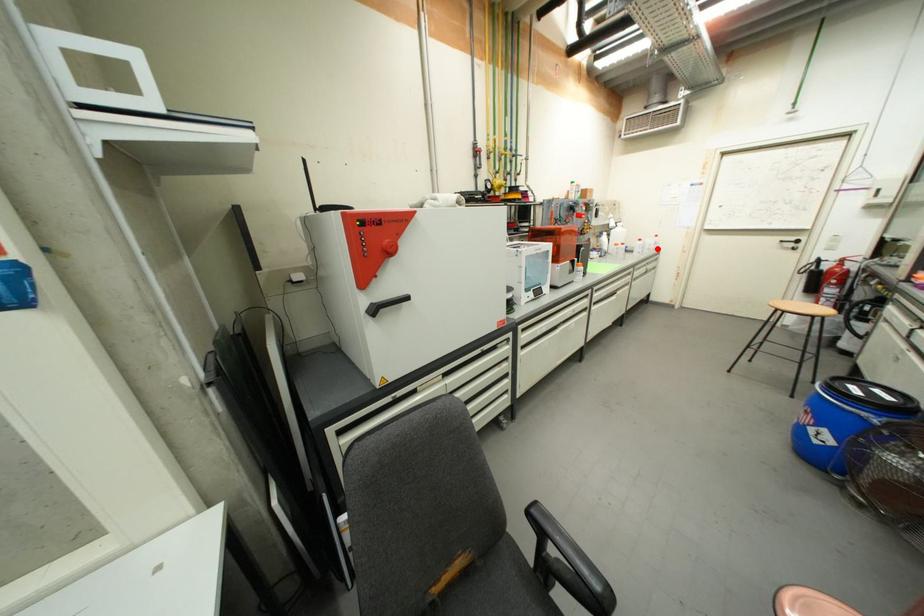
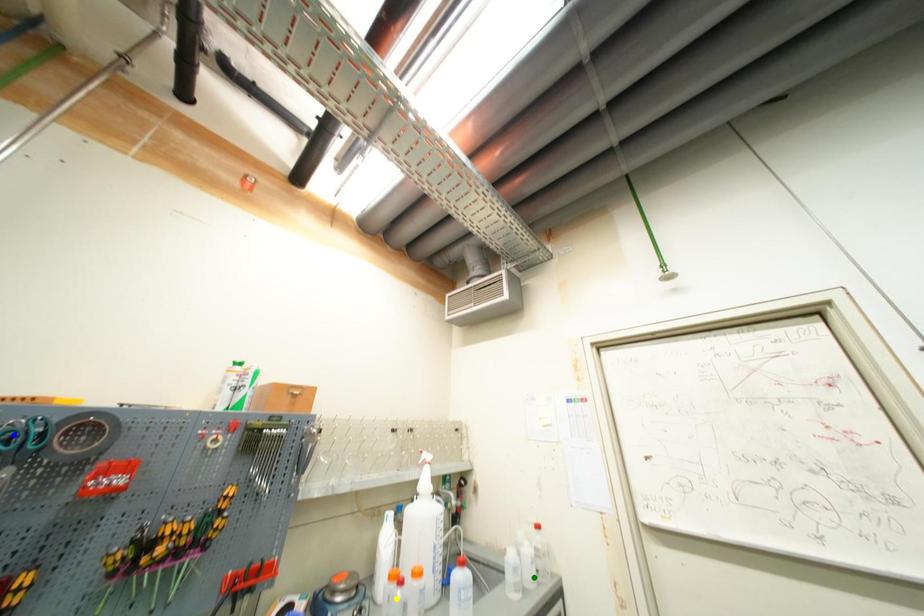
Question: I am providing you with two images of the same scene from different viewpoints. A red point is marked on the first image. You are given multiple points on the second image. In image 2, which mark is for the same physical point as the one in image 1?

Choices:
 (A) green point
 (B) blue point
 (C) yellow point

Answer: (A)